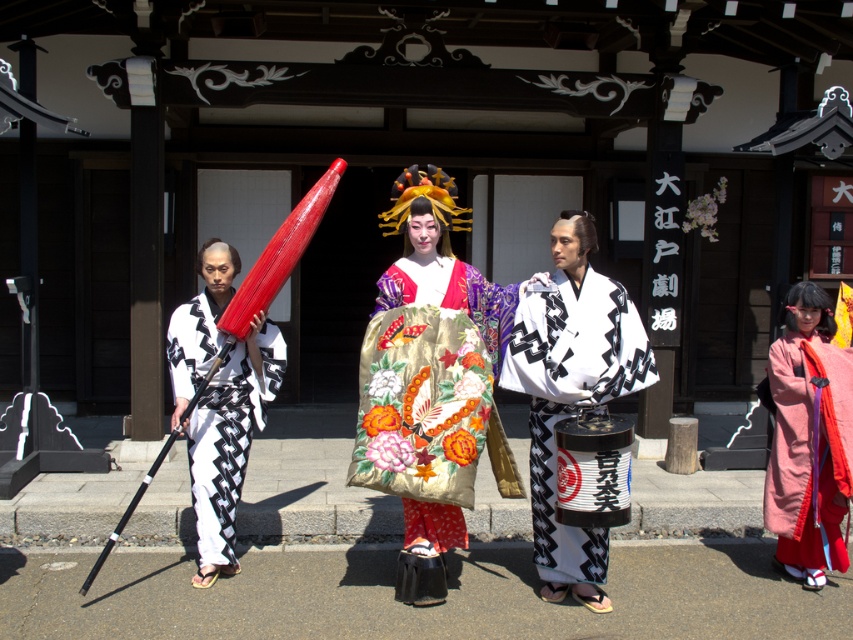
You are an event planner arranging a photo shoot at this location. You need to position a camera to capture both the white silk kimono at center and the silky pink kimono at center clearly. Given their positions, which kimono should be placed higher in the frame to ensure both are visible?

The white silk kimono at center is already above the silky pink kimono at center, so positioning the camera to focus on the white silk kimono at center higher in the frame will naturally include the silky pink kimono at center below it, ensuring both are visible.

You are standing in front of the traditional wooden building and want to walk towards the two points marked in the image. Which point, point (412,380) or point (531,461), would you reach first?

Point (412,380) is closer to the viewer than point (531,461), so you would reach point (412,380) first.